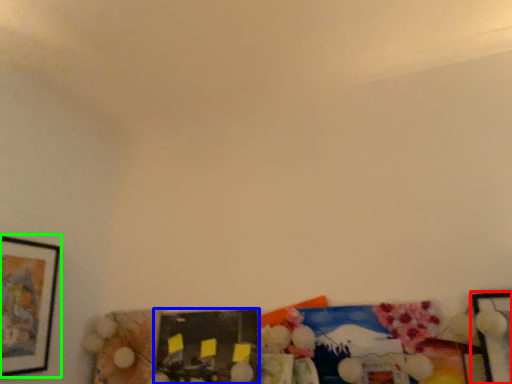
Question: Estimate the real-world distances between objects in this image. Which object is closer to picture frame (highlighted by a red box), picture frame (highlighted by a blue box) or picture frame (highlighted by a green box)?

Choices:
 (A) picture frame
 (B) picture frame

Answer: (A)